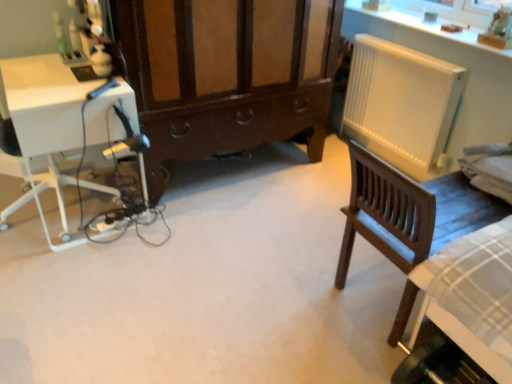
Question: From the image's perspective, is brown wood cabinet at center on white plastic radiator at right?

Choices:
 (A) no
 (B) yes

Answer: (B)

Question: From a real-world perspective, is brown wood cabinet at center on top of white plastic radiator at right?

Choices:
 (A) no
 (B) yes

Answer: (B)

Question: From a real-world perspective, is brown wood cabinet at center positioned under white plastic radiator at right based on gravity?

Choices:
 (A) yes
 (B) no

Answer: (B)

Question: Is brown wood cabinet at center at the left side of white plastic radiator at right?

Choices:
 (A) no
 (B) yes

Answer: (B)

Question: Is brown wood cabinet at center bigger than white plastic radiator at right?

Choices:
 (A) yes
 (B) no

Answer: (A)

Question: From their relative heights in the image, would you say brown wood cabinet at center is taller or shorter than white plastic radiator at right?

Choices:
 (A) tall
 (B) short

Answer: (A)

Question: From the image's perspective, relative to white plastic radiator at right, is brown wood cabinet at center above or below?

Choices:
 (A) above
 (B) below

Answer: (A)

Question: Is brown wood cabinet at center spatially inside white plastic radiator at right, or outside of it?

Choices:
 (A) inside
 (B) outside

Answer: (B)

Question: Is point (153, 38) positioned closer to the camera than point (348, 125)?

Choices:
 (A) farther
 (B) closer

Answer: (B)

Question: From a real-world perspective, relative to brown wood cabinet at center, is white plastic radiator at right vertically above or below?

Choices:
 (A) below
 (B) above

Answer: (A)

Question: Is white plastic radiator at right inside the boundaries of brown wood cabinet at center, or outside?

Choices:
 (A) outside
 (B) inside

Answer: (A)

Question: In the image, is white plastic radiator at right positioned in front of or behind brown wood cabinet at center?

Choices:
 (A) front
 (B) behind

Answer: (B)

Question: Considering the positions of white plastic radiator at right and brown wood cabinet at center in the image, is white plastic radiator at right wider or thinner than brown wood cabinet at center?

Choices:
 (A) wide
 (B) thin

Answer: (B)

Question: Is white plastic computer desk at left spatially inside white plastic radiator at right, or outside of it?

Choices:
 (A) inside
 (B) outside

Answer: (B)

Question: Considering their positions, is white plastic computer desk at left located in front of or behind white plastic radiator at right?

Choices:
 (A) behind
 (B) front

Answer: (B)